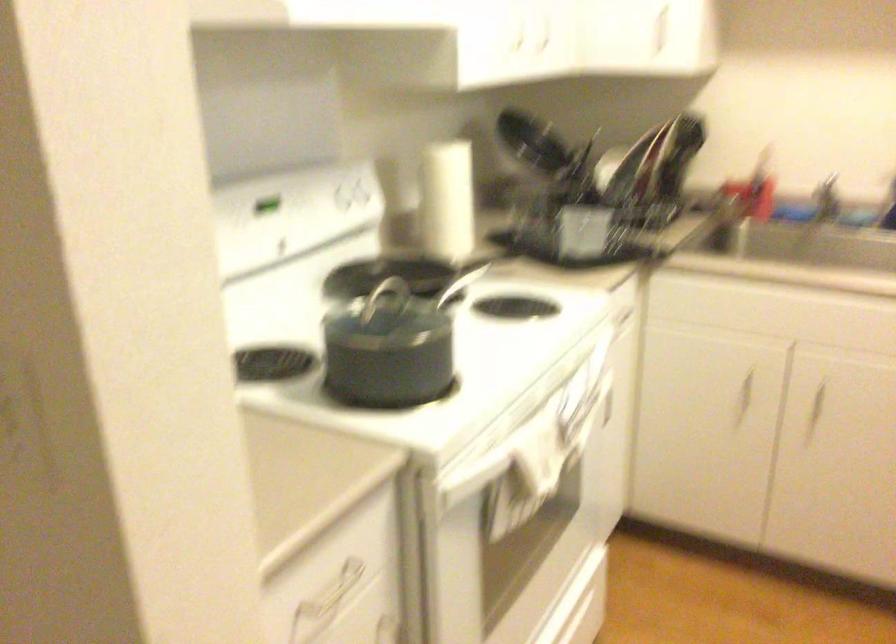
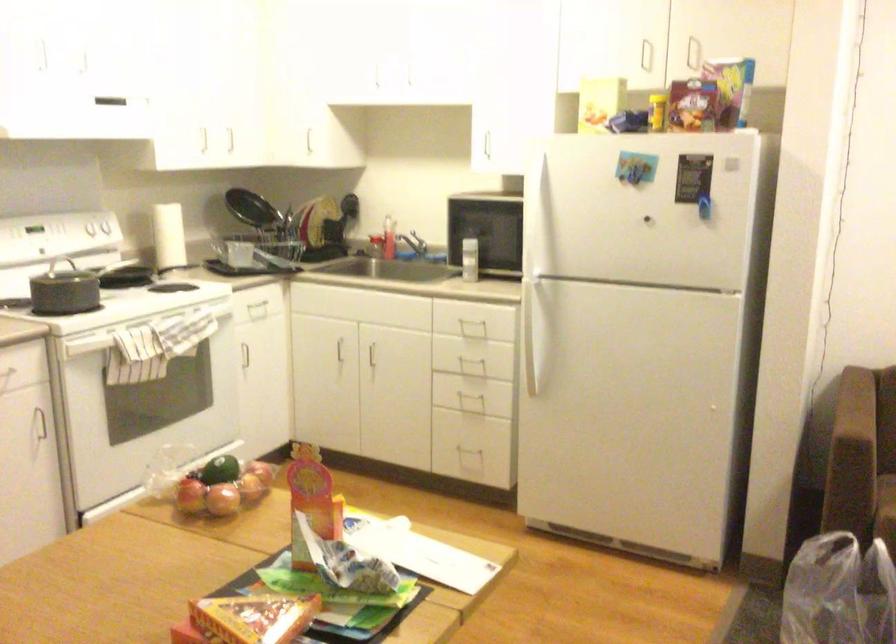
What movement of the cameraman would produce the second image?

The cameraman moved toward right, backward.